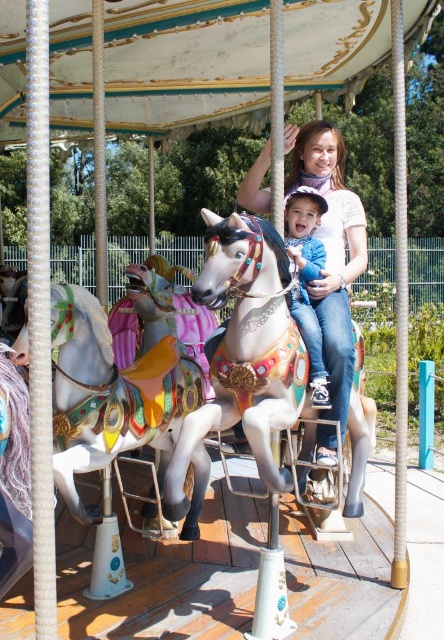
Question: Does shiny metallic horse at center have a lesser width compared to blue denim jeans at center?

Choices:
 (A) no
 (B) yes

Answer: (A)

Question: Does polished silver horse at center have a greater width compared to blue denim jeans at center?

Choices:
 (A) no
 (B) yes

Answer: (B)

Question: Among these objects, which one is farthest from the camera?

Choices:
 (A) shiny metallic horse at center
 (B) polished silver horse at center

Answer: (B)

Question: Which object is positioned farthest from the polished silver horse at center?

Choices:
 (A) blue denim jeans at center
 (B) shiny metallic horse at center

Answer: (B)

Question: Estimate the real-world distances between objects in this image. Which object is closer to the shiny metallic horse at center?

Choices:
 (A) blue denim jeans at center
 (B) matte white shirt at center
 (C) polished silver horse at center

Answer: (C)

Question: Can you confirm if polished silver horse at center is positioned above matte white shirt at center?

Choices:
 (A) yes
 (B) no

Answer: (B)